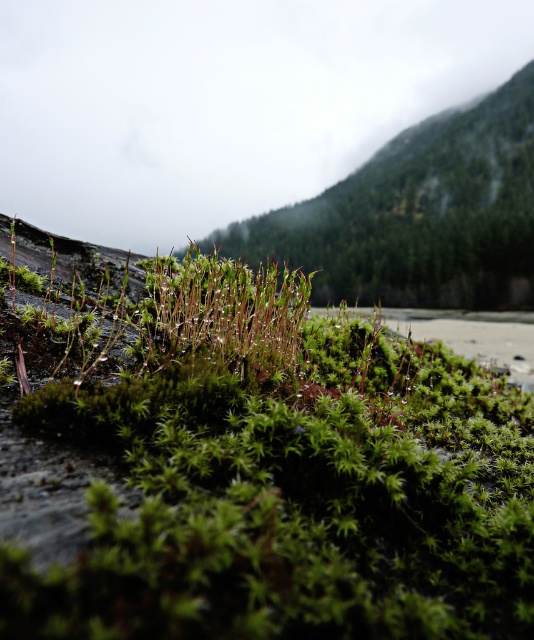
You are a botanist examining the mossy surface. You need to determine which of the two plants, the green fuzzy moss at center or the green mossy plant at center, requires more space to grow. Based on their sizes, which one would you recommend planting in a larger container?

The green fuzzy moss at center is larger in size than the green mossy plant at center, so it would require more space to grow and should be planted in a larger container.

You are a botanist examining a mossy surface. You notice a green fuzzy moss at center. Can you determine its exact location on the surface?

The green fuzzy moss at center is located at point (x=277, y=470).

In the scene shown: You are standing in a natural setting and see the green fuzzy moss at center and the green mossy hillside at upper center. Which object is positioned to the left?

The green fuzzy moss at center is positioned to the left of the green mossy hillside at upper center.